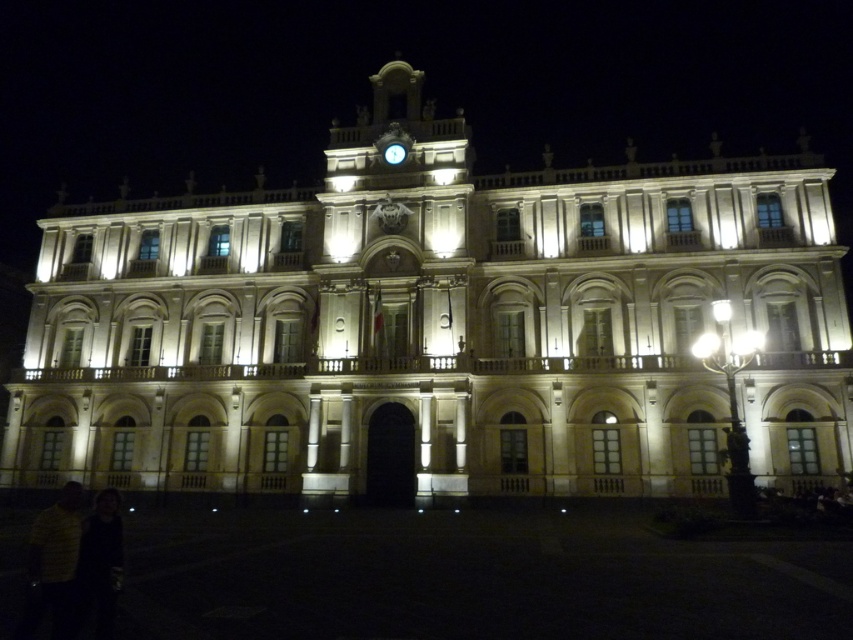
Is point (807, 232) closer to viewer compared to point (402, 160)?

That is True.

Can you confirm if beige stone building at center is taller than metallic clock at upper center?

Yes.

Who is more distant from viewer, (308, 218) or (392, 154)?

Positioned behind is point (308, 218).

You are a GUI agent. You are given a task and a screenshot of the screen. Output one action in this format:
    pyautogui.click(x=<x>, y=<y>)
    Task: Click on the beige stone building at center
    
    Given the screenshot: What is the action you would take?
    pyautogui.click(x=437, y=326)